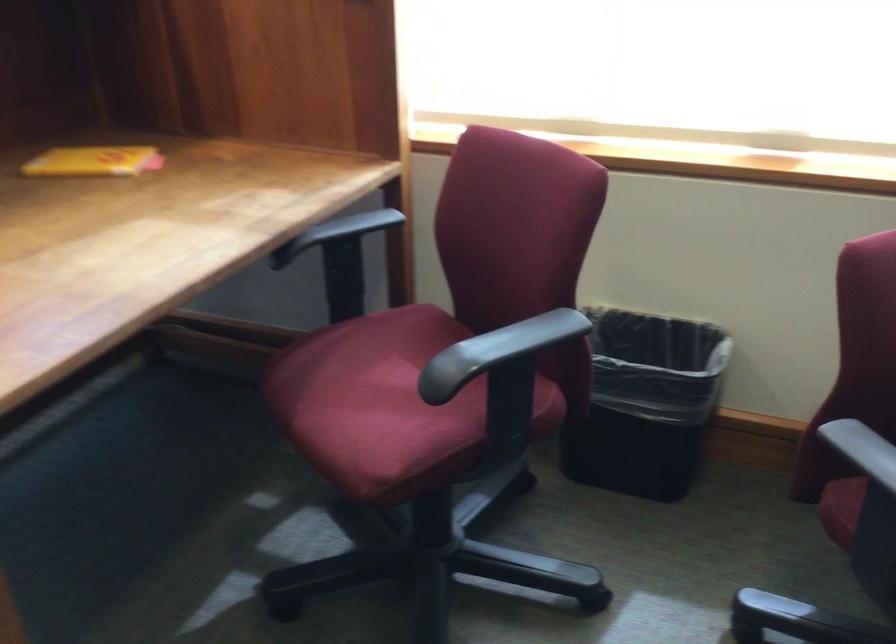
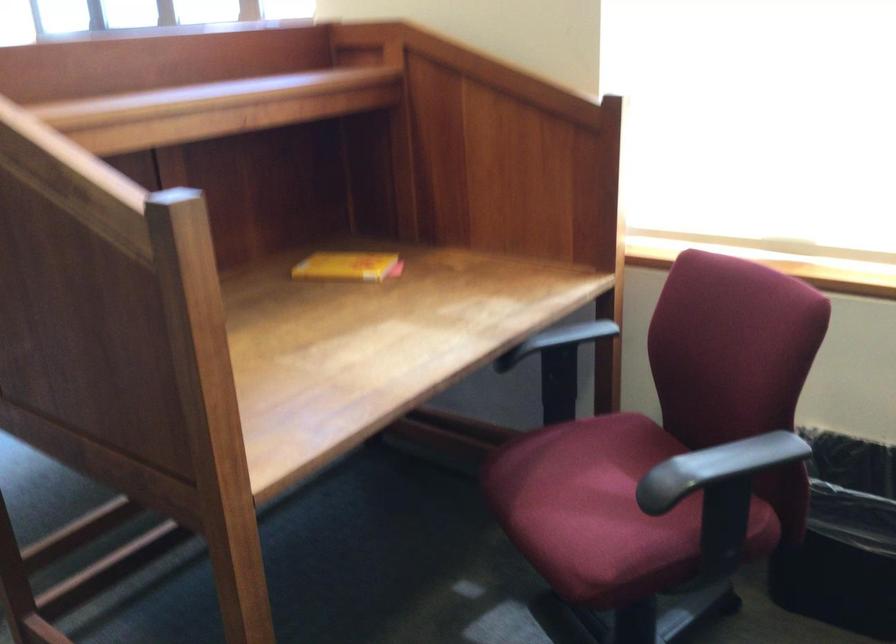
Find the pixel in the second image that matches point (334, 230) in the first image.

(556, 339)